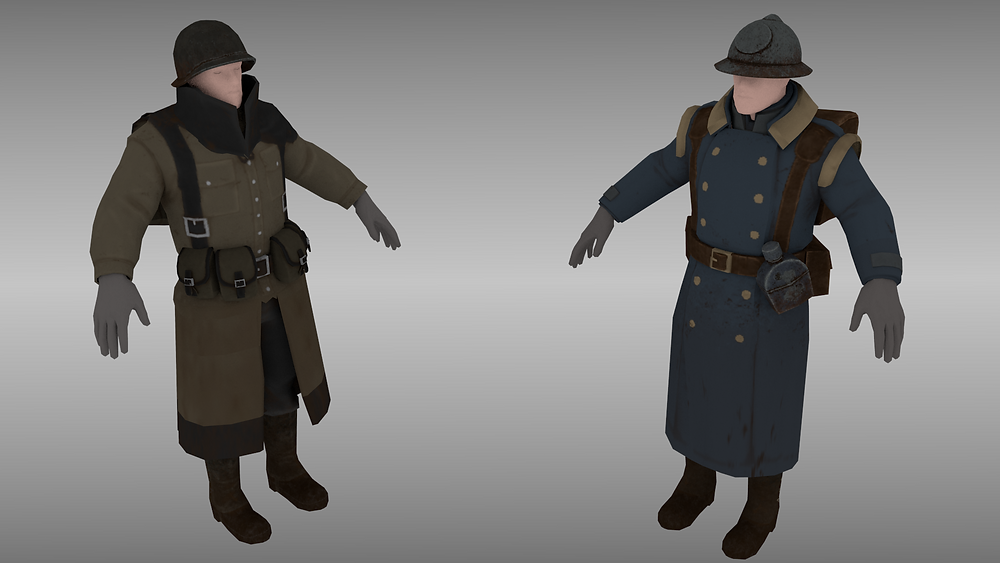
The width and height of the screenshot is (1000, 563). I want to click on coat, so click(744, 176), click(236, 187).